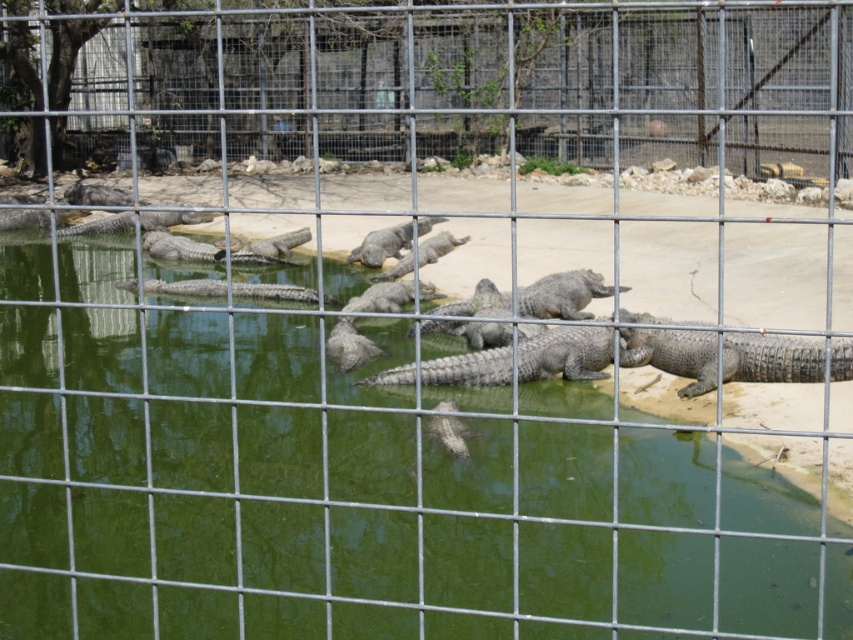
You are a visitor at a zoo and see the green murky water at center and the gray scaly crocodile at center through the fence. Can you tell which one is closer to you?

The green murky water at center is closer to you because it is in front of the gray scaly crocodile at center.